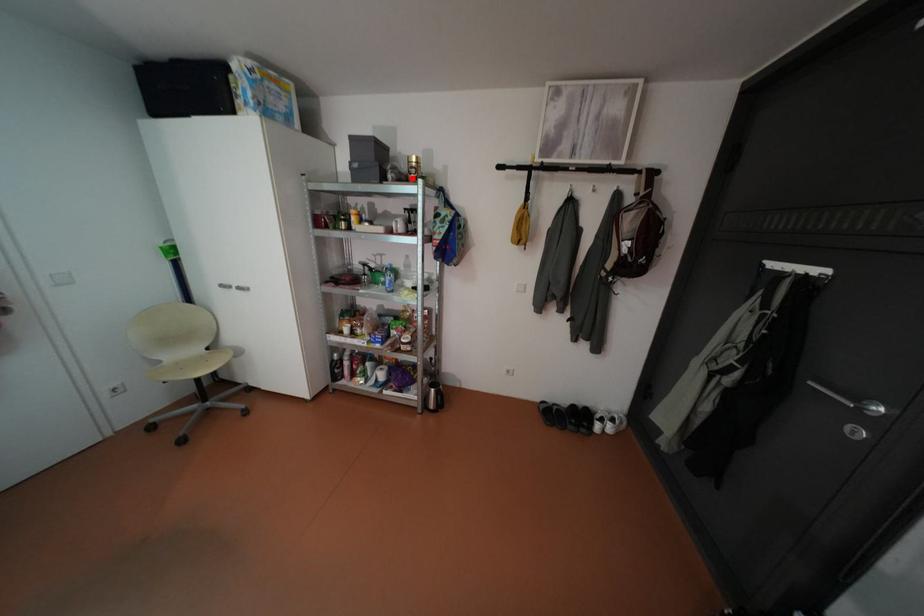
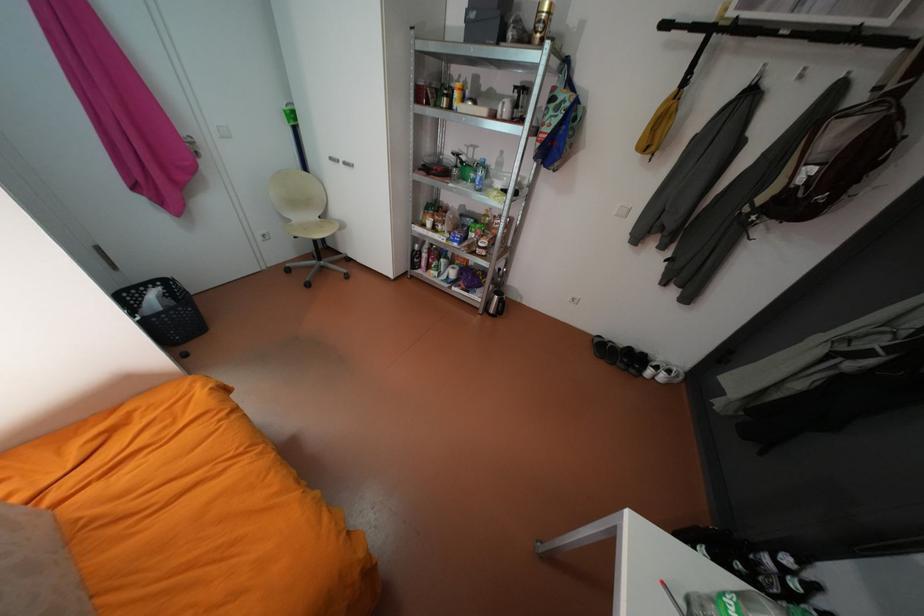
In the second image, find the point that corresponds to the highlighted location in the first image.

(533, 39)